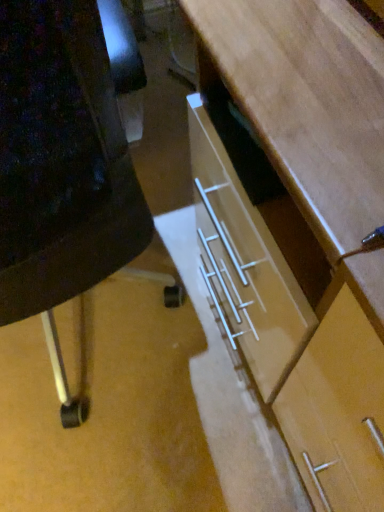
Question: From a real-world perspective, is white plastic drawer at lower center positioned over wooden desk at center based on gravity?

Choices:
 (A) no
 (B) yes

Answer: (B)

Question: Is white plastic drawer at lower center aimed at wooden desk at center?

Choices:
 (A) yes
 (B) no

Answer: (B)

Question: Is wooden desk at center inside white plastic drawer at lower center?

Choices:
 (A) no
 (B) yes

Answer: (A)

Question: Considering the relative sizes of white plastic drawer at lower center and wooden desk at center in the image provided, is white plastic drawer at lower center taller than wooden desk at center?

Choices:
 (A) yes
 (B) no

Answer: (A)

Question: Can you confirm if white plastic drawer at lower center is thinner than wooden desk at center?

Choices:
 (A) no
 (B) yes

Answer: (B)

Question: Is white plastic drawer at lower center facing away from wooden desk at center?

Choices:
 (A) yes
 (B) no

Answer: (B)

Question: Is wooden desk at center looking in the opposite direction of white plastic drawer at lower center?

Choices:
 (A) yes
 (B) no

Answer: (B)

Question: Could you tell me if wooden desk at center is facing white plastic drawer at lower center?

Choices:
 (A) no
 (B) yes

Answer: (A)

Question: Is wooden desk at center shorter than white plastic drawer at lower center?

Choices:
 (A) yes
 (B) no

Answer: (A)

Question: Is wooden desk at center to the left of white plastic drawer at lower center from the viewer's perspective?

Choices:
 (A) yes
 (B) no

Answer: (B)

Question: From a real-world perspective, is wooden desk at center physically above white plastic drawer at lower center?

Choices:
 (A) no
 (B) yes

Answer: (A)

Question: Can you confirm if wooden desk at center is bigger than white plastic drawer at lower center?

Choices:
 (A) no
 (B) yes

Answer: (A)

Question: Is white plastic drawer at lower center inside or outside of wooden desk at center?

Choices:
 (A) outside
 (B) inside

Answer: (A)